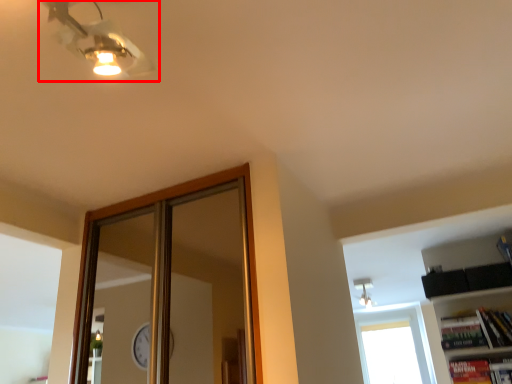
Question: In this image, where is fan (annotated by the red box) located relative to window?

Choices:
 (A) right
 (B) left

Answer: (B)